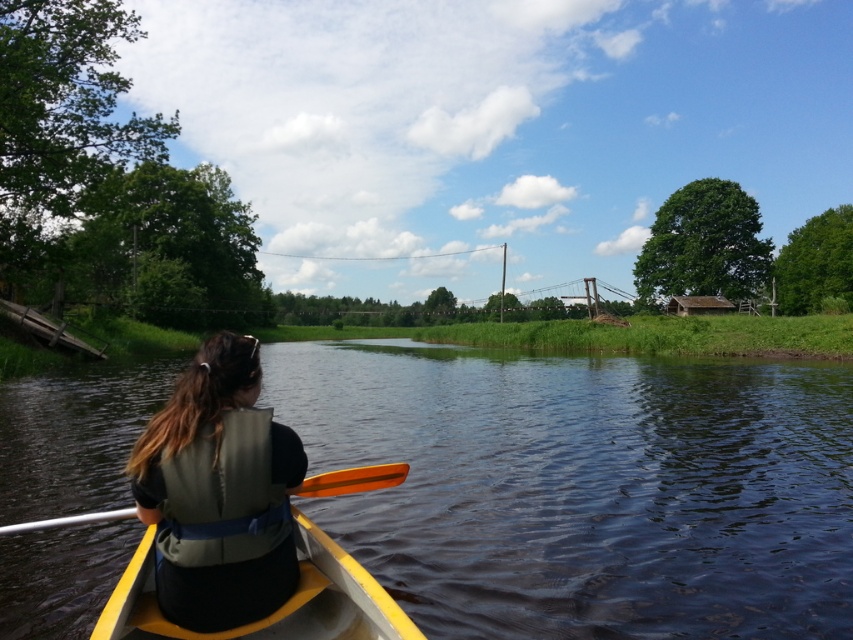
In the scene shown: You are a photographer trying to capture the reflection of the orange wood paddle at center in the green smooth water at center. Based on the scene description, will the paddle be fully visible in the reflection?

The green smooth water at center has a greater height compared to orange wood paddle at center. Since the water is taller than the paddle, the reflection of the orange wood paddle at center will be fully visible in the green smooth water at center.